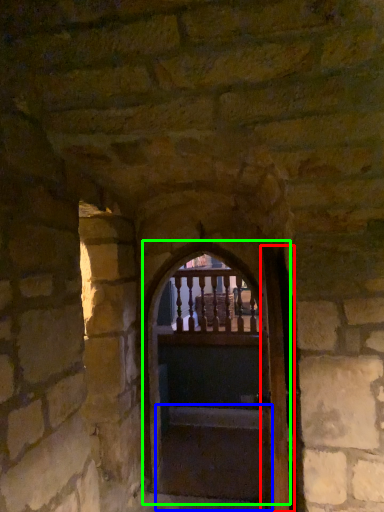
Question: Based on their relative distances, which object is nearer to door (highlighted by a red box)? Choose from stairs (highlighted by a blue box) and door (highlighted by a green box).

Choices:
 (A) stairs
 (B) door

Answer: (A)